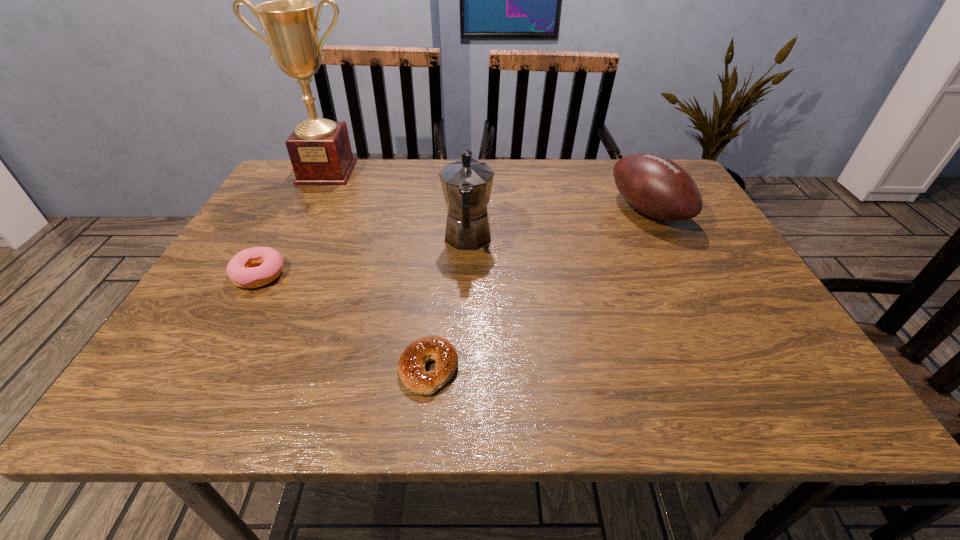
Locate an element on the screen. Image resolution: width=960 pixels, height=540 pixels. vacant point that satisfies the following two spatial constraints: 1. on the pouring side of the second tallest object; 2. on the left side of the third shortest object is located at coordinates (468, 211).

Locate an element on the screen. free space that satisfies the following two spatial constraints: 1. on the plaque of the football (American); 2. on the left side of the trophy cup is located at coordinates (307, 211).

You are a GUI agent. You are given a task and a screenshot of the screen. Output one action in this format:
    pyautogui.click(x=<x>, y=<y>)
    Task: Click on the blank space that satisfies the following two spatial constraints: 1. on the plaque of the farthest object; 2. on the left side of the third shortest object
    
    Given the screenshot: What is the action you would take?
    pyautogui.click(x=307, y=211)

Where is `vacant space that satisfies the following two spatial constraints: 1. on the pouring side of the third shortest object; 2. on the left side of the fourth shortest object`? vacant space that satisfies the following two spatial constraints: 1. on the pouring side of the third shortest object; 2. on the left side of the fourth shortest object is located at coordinates pyautogui.click(x=468, y=211).